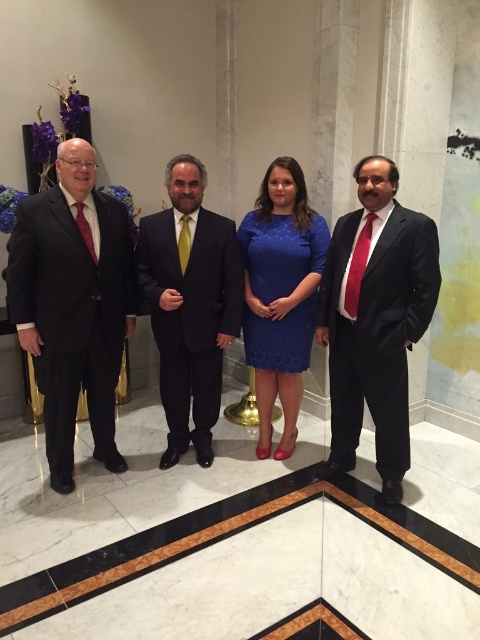
You are a photographer setting up for a group photo. You need to position a spotlight so that it illuminates both the matte black suit at left and the blue textured dress at center. Based on their positions, which object should be placed higher in the frame to ensure both are properly lit?

The blue textured dress at center should be placed higher in the frame because the matte black suit at left is below it, ensuring the spotlight can effectively illuminate both.

You are a photographer positioned at the front of the scene. You need to adjust your camera focus to capture both the shiny black suit at right and the blue textured dress at center. Which one should you focus on first to ensure both are in sharp focus?

The shiny black suit at right is closer to the viewer than the blue textured dress at center. To ensure both are in sharp focus, you should focus on the shiny black suit at right first, as it is closer, and the depth of field will naturally extend to the farther object.

You are standing in front of the group of four individuals in the formal setting. You notice two points marked on the floor at coordinates point (69,301) and point (323,227). Which point is closer to you?

Point (69,301) is in front of point (323,227), so it is closer to you.